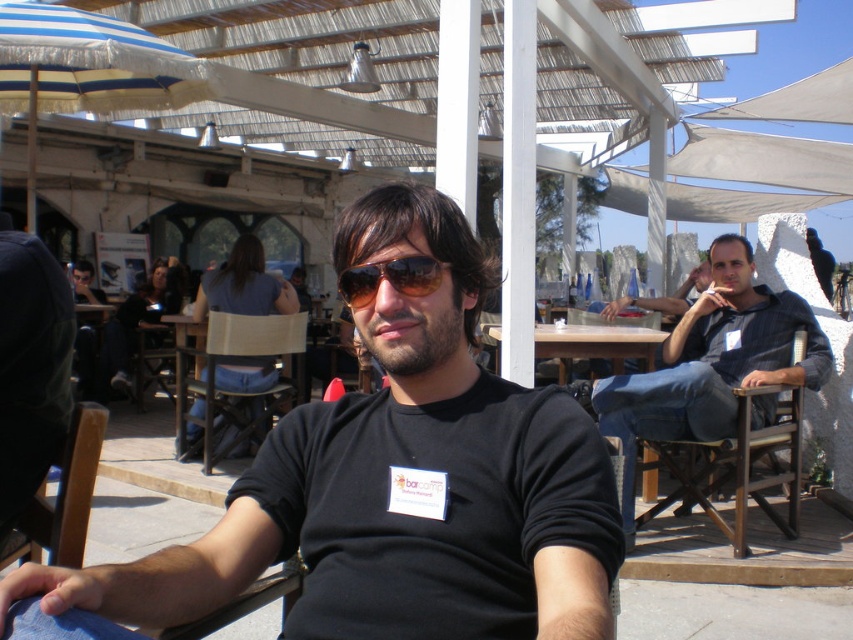
Which is behind, point (788, 429) or point (337, 282)?

The point (337, 282) is behind.

Who is more forward, (793, 356) or (340, 289)?

Point (340, 289) is more forward.

This screenshot has width=853, height=640. Identify the location of wooden chair at right. (735, 465).

The width and height of the screenshot is (853, 640). In order to click on wooden chair at right in this screenshot , I will do `click(735, 465)`.

Is burlap fabric chair at center shorter than wooden table at center?

Incorrect, burlap fabric chair at center's height does not fall short of wooden table at center's.

Which is above, burlap fabric chair at center or wooden table at center?

wooden table at center is higher up.

Does point (305, 340) come farther from viewer compared to point (584, 348)?

Yes, point (305, 340) is farther from viewer.

Where is `burlap fabric chair at center`? Image resolution: width=853 pixels, height=640 pixels. burlap fabric chair at center is located at coordinates (236, 388).

Looking at this image, is wooden chair at left above wooden table at center?

No.

Is point (47, 528) positioned before point (585, 356)?

Yes.

What are the coordinates of `wooden chair at left` in the screenshot? It's located at (62, 499).